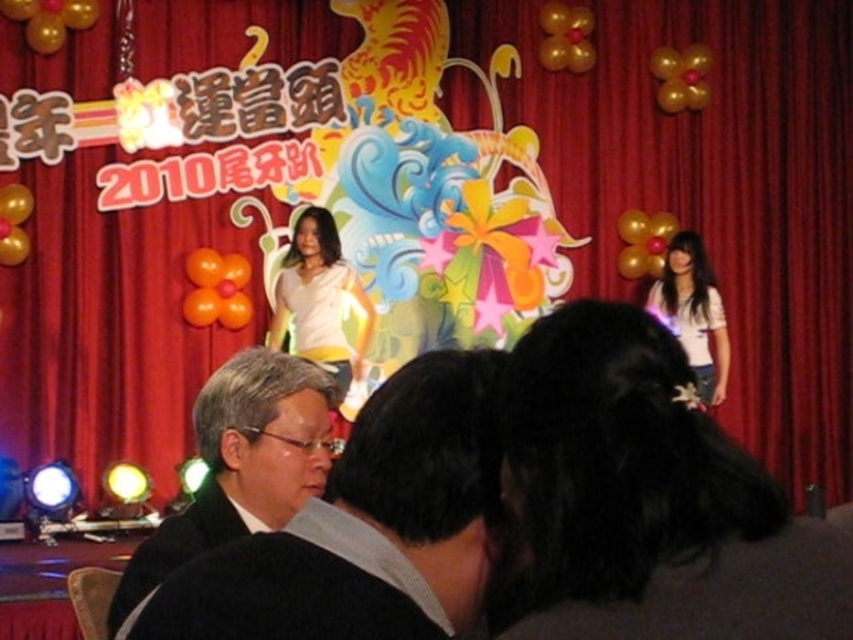
Which is in front, point (332, 602) or point (306, 237)?

Point (332, 602)

Between point (390, 486) and point (323, 305), which one is positioned in front?

Point (390, 486)

This screenshot has width=853, height=640. Find the location of `black matte suit at lower left`. black matte suit at lower left is located at coordinates (366, 528).

Can you confirm if white matte shirt at center is shorter than white matte shirt at right?

Indeed, white matte shirt at center has a lesser height compared to white matte shirt at right.

The image size is (853, 640). What do you see at coordinates (318, 298) in the screenshot?
I see `white matte shirt at center` at bounding box center [318, 298].

You are a GUI agent. You are given a task and a screenshot of the screen. Output one action in this format:
    pyautogui.click(x=<x>, y=<y>)
    Task: Click on the white matte shirt at center
    This screenshot has width=853, height=640.
    Given the screenshot: What is the action you would take?
    [x=318, y=298]

You are a GUI agent. You are given a task and a screenshot of the screen. Output one action in this format:
    pyautogui.click(x=<x>, y=<y>)
    Task: Click on the white matte shirt at center
    
    Given the screenshot: What is the action you would take?
    pyautogui.click(x=318, y=298)

Does black matte suit at lower left have a lesser height compared to white matte shirt at right?

Indeed, black matte suit at lower left has a lesser height compared to white matte shirt at right.

Between black matte suit at lower left and white matte shirt at right, which one has less height?

Standing shorter between the two is black matte suit at lower left.

Is point (430, 480) closer to camera compared to point (654, 308)?

Yes, point (430, 480) is closer to viewer.

Image resolution: width=853 pixels, height=640 pixels. I want to click on black matte suit at lower left, so click(366, 528).